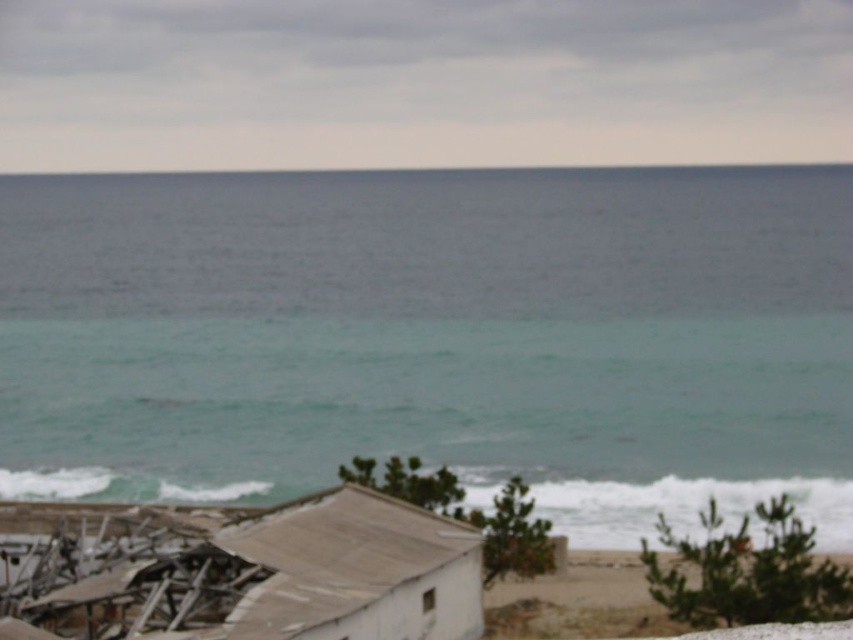
Who is more forward, (x=547, y=513) or (x=259, y=518)?

Positioned in front is point (x=259, y=518).

Is point (196, 296) more distant than point (172, 557)?

That is True.

At what (x,y) coordinates should I click in order to perform the action: click on teal water at center. Please return your answer as a coordinate pair (x, y). Looking at the image, I should click on click(x=434, y=337).

You are a GUI agent. You are given a task and a screenshot of the screen. Output one action in this format:
    pyautogui.click(x=<x>, y=<y>)
    Task: Click on the teal water at center
    
    Given the screenshot: What is the action you would take?
    pyautogui.click(x=434, y=337)